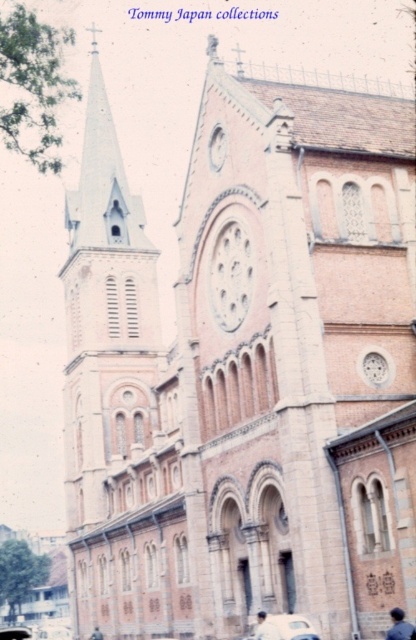
Question: Among these objects, which one is nearest to the camera?

Choices:
 (A) white matte car at lower center
 (B) dark brown leather jacket at lower center
 (C) white matte shirt at center

Answer: (A)

Question: Can you confirm if dark blue fabric at lower right is wider than white matte shirt at center?

Choices:
 (A) yes
 (B) no

Answer: (A)

Question: Which point is farther to the camera?

Choices:
 (A) (267, 620)
 (B) (99, 636)
 (C) (410, 625)
 (D) (245, 637)

Answer: (B)

Question: Which object appears closest to the camera in this image?

Choices:
 (A) white matte shirt at center
 (B) dark blue fabric at lower right
 (C) dark brown leather jacket at lower center

Answer: (B)

Question: Does white matte car at lower center come in front of white matte shirt at center?

Choices:
 (A) no
 (B) yes

Answer: (B)

Question: Can you confirm if dark blue fabric at lower right is positioned above dark brown leather jacket at lower center?

Choices:
 (A) no
 (B) yes

Answer: (B)